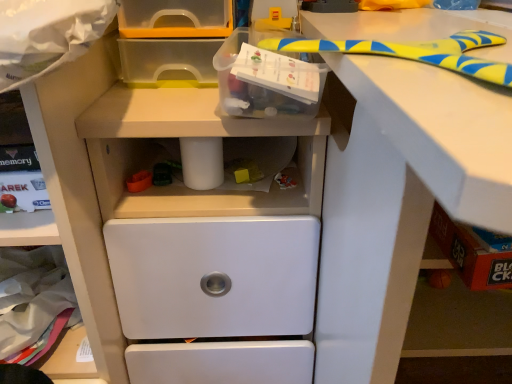
Identify the location of vacant area situated to the left side of translucent plastic box at upper center. (178, 98).